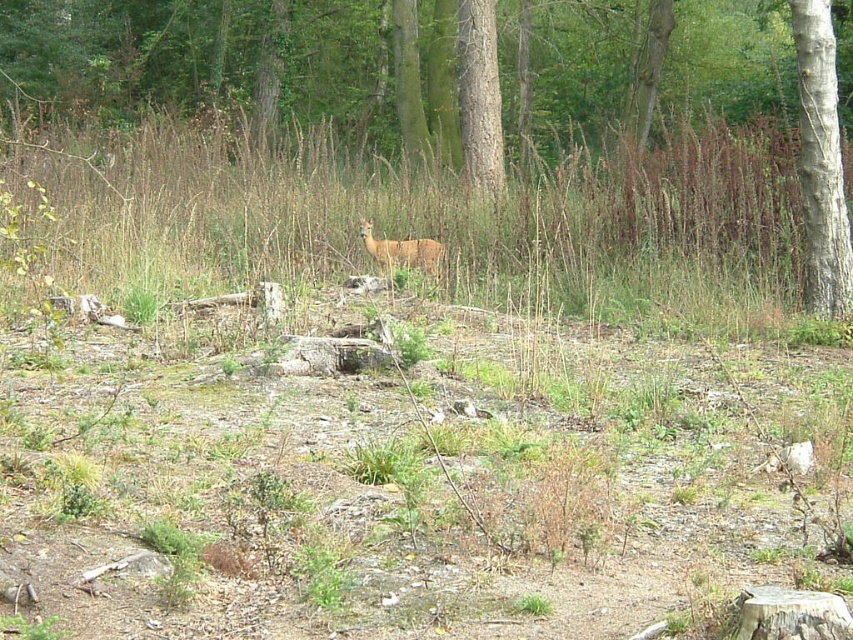
You are a hiker trying to navigate through the woodland. You see the smooth bark tree at right and the brown matte deer at center. Which object is taller and can be used as a landmark for navigation?

The smooth bark tree at right is much taller than the brown matte deer at center, so it can be used as a more prominent landmark for navigation.

Consider the image. You are a hiker navigating through the woodland scene. You need to reach the brown wood tree at center. From your current position, which direction should you move to get closer to the tree?

The brown wood tree at center is located at point (459, 134), so you should move towards the center of the image to reach it.

You are a hiker trying to navigate through the woodland scene. You need to pass between the brown wood tree at center and the smooth bark tree at right. Considering their widths, which tree will you have to maneuver closer to in order to fit through the narrowest point?

The smooth bark tree at right has a narrower width compared to the brown wood tree at center. To fit through the narrowest point, you should maneuver closer to the smooth bark tree at right since it requires less space.